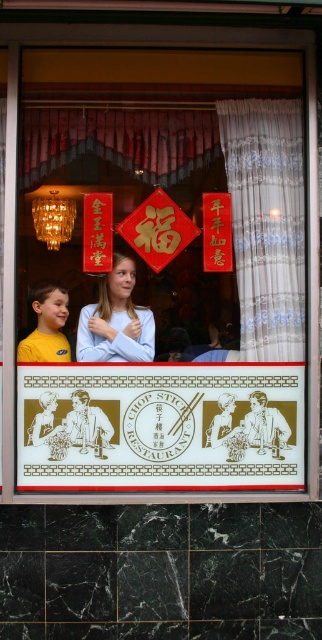
Who is higher up, light blue fabric at center or red paper sign at upper center?

Positioned higher is red paper sign at upper center.

Between light blue fabric at center and red paper sign at upper center, which one has more height?

light blue fabric at center

Is point (145, 342) closer to camera compared to point (217, 250)?

No.

Where is `light blue fabric at center`? Image resolution: width=322 pixels, height=640 pixels. light blue fabric at center is located at coordinates pyautogui.click(x=115, y=321).

Does light blue fabric at center come in front of gold paper sign at upper center?

No, light blue fabric at center is behind gold paper sign at upper center.

Image resolution: width=322 pixels, height=640 pixels. Identify the location of light blue fabric at center. (115, 321).

Locate an element on the screen. The image size is (322, 640). light blue fabric at center is located at coordinates (115, 321).

What are the coordinates of `light blue fabric at center` in the screenshot? It's located at (115, 321).

Does gold paper sign at center have a lesser width compared to gold paper sign at upper center?

Incorrect, gold paper sign at center's width is not less than gold paper sign at upper center's.

Does point (115, 385) lie in front of point (88, 243)?

That is True.

Who is more forward, (181, 458) or (103, 193)?

Point (181, 458) is more forward.

The image size is (322, 640). Identify the location of gold paper sign at center. (160, 426).